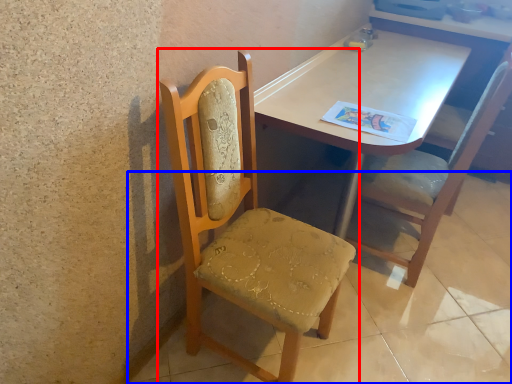
Question: Which object is closer to the camera taking this photo, chair (highlighted by a red box) or concrete (highlighted by a blue box)?

Choices:
 (A) chair
 (B) concrete

Answer: (A)